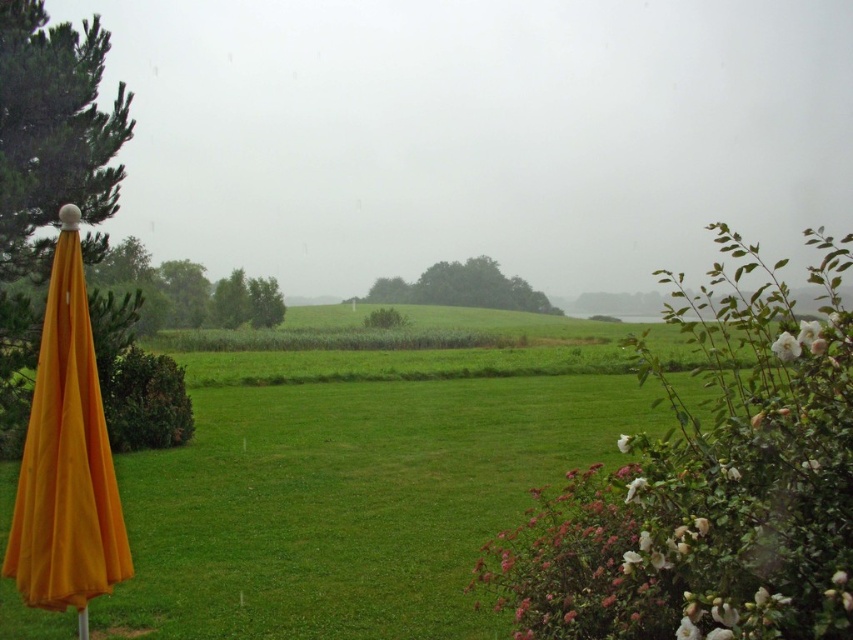
Question: In this image, where is orange fabric umbrella at left located relative to white matte flower at lower right?

Choices:
 (A) right
 (B) left

Answer: (B)

Question: Which object is the closest to the white matte flower at lower right?

Choices:
 (A) white matte flower at upper right
 (B) orange fabric umbrella at left

Answer: (A)

Question: Where is white matte flower at upper right located in relation to white matte flower at lower right in the image?

Choices:
 (A) below
 (B) above

Answer: (B)

Question: Is orange fabric umbrella at left positioned before white matte flower at lower right?

Choices:
 (A) yes
 (B) no

Answer: (B)

Question: Estimate the real-world distances between objects in this image. Which object is closer to the orange fabric umbrella at left?

Choices:
 (A) white matte flower at lower right
 (B) white matte flower at upper right

Answer: (A)

Question: Among these objects, which one is farthest from the camera?

Choices:
 (A) orange fabric umbrella at left
 (B) white matte flower at upper right

Answer: (A)